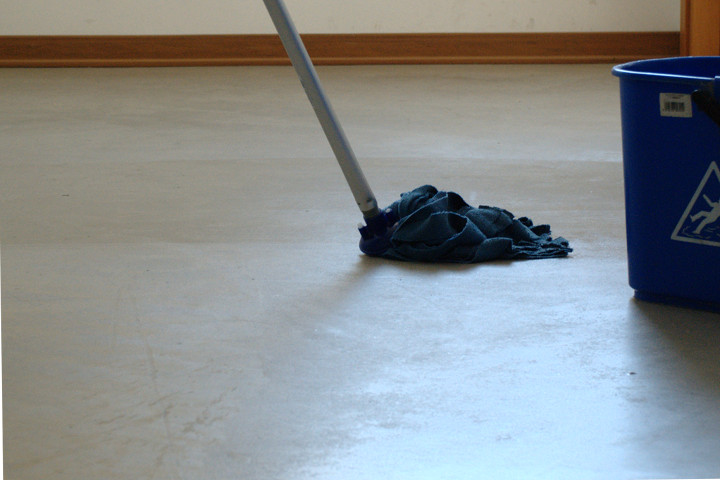
The image size is (720, 480). Identify the location of baseboard. (396, 46).